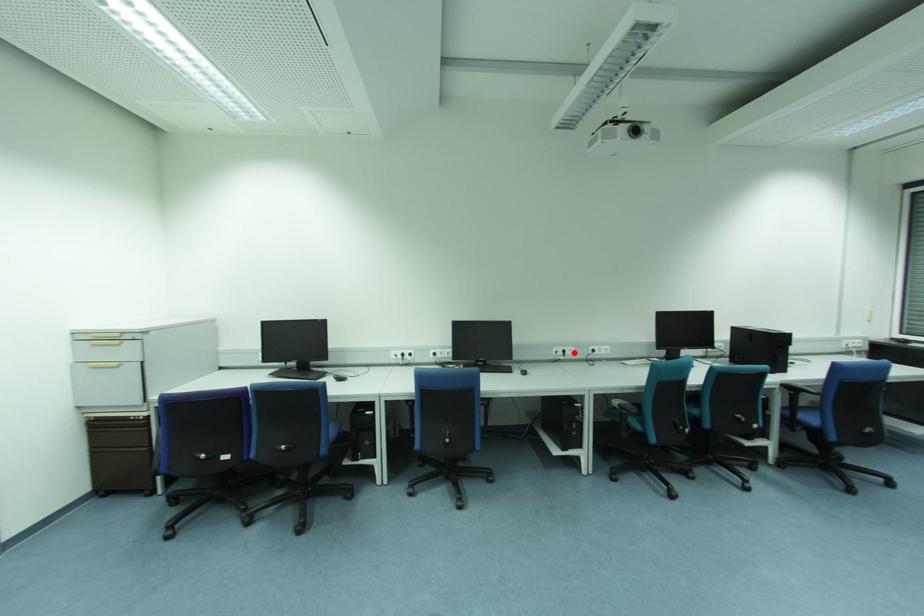
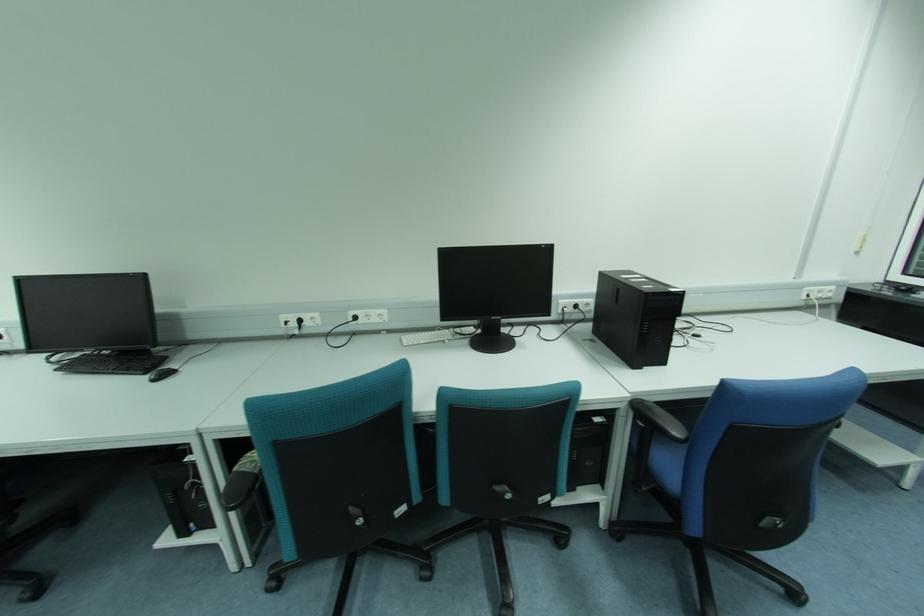
In the second image, find the point that corresponds to the highlighted location in the first image.

(319, 322)